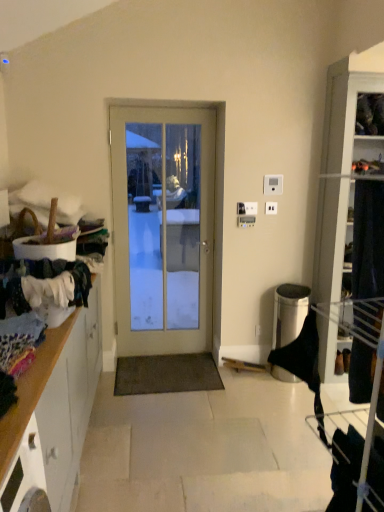
Question: Is white glass door at center inside white plastic electric outlet at center?

Choices:
 (A) yes
 (B) no

Answer: (B)

Question: Could you tell me if white plastic electric outlet at center is turned towards white glass door at center?

Choices:
 (A) no
 (B) yes

Answer: (A)

Question: Considering the relative positions of white plastic electric outlet at center and white glass door at center in the image provided, is white plastic electric outlet at center to the left of white glass door at center from the viewer's perspective?

Choices:
 (A) no
 (B) yes

Answer: (A)

Question: Is white plastic electric outlet at center further to the viewer compared to white glass door at center?

Choices:
 (A) no
 (B) yes

Answer: (B)

Question: Is white plastic electric outlet at center shorter than white glass door at center?

Choices:
 (A) no
 (B) yes

Answer: (B)

Question: Is white glass door at center bigger or smaller than white plastic light switch at upper center, marked as the 1th light switch in a bottom-to-top arrangement?

Choices:
 (A) big
 (B) small

Answer: (A)

Question: From a real-world perspective, relative to white plastic light switch at upper center, placed as the 2th light switch when sorted from right to left, is white glass door at center vertically above or below?

Choices:
 (A) below
 (B) above

Answer: (A)

Question: Considering the relative positions of white glass door at center and white plastic light switch at upper center, the 2th light switch positioned from the top, in the image provided, is white glass door at center to the left or to the right of white plastic light switch at upper center, the 2th light switch positioned from the top,?

Choices:
 (A) right
 (B) left

Answer: (B)

Question: From the image's perspective, relative to white plastic light switch at upper center, the 2th light switch positioned from the top, is white glass door at center above or below?

Choices:
 (A) above
 (B) below

Answer: (B)

Question: Is white plastic electric outlet at center spatially inside wooden cabinet at left, or outside of it?

Choices:
 (A) inside
 (B) outside

Answer: (B)

Question: Would you say white plastic electric outlet at center is to the left or to the right of wooden cabinet at left in the picture?

Choices:
 (A) left
 (B) right

Answer: (B)

Question: Looking at their shapes, would you say white plastic electric outlet at center is wider or thinner than wooden cabinet at left?

Choices:
 (A) thin
 (B) wide

Answer: (A)

Question: From the image's perspective, is white plastic electric outlet at center positioned above or below wooden cabinet at left?

Choices:
 (A) above
 (B) below

Answer: (A)

Question: Is white plastic light switch at upper center, which appears as the 1th light switch when viewed from the left, to the left or to the right of white plastic light switch at upper center, acting as the first light switch starting from the right, in the image?

Choices:
 (A) right
 (B) left

Answer: (B)

Question: Is point (246, 202) positioned closer to the camera than point (276, 186)?

Choices:
 (A) farther
 (B) closer

Answer: (B)